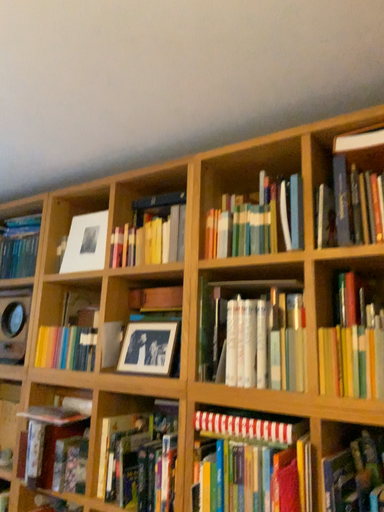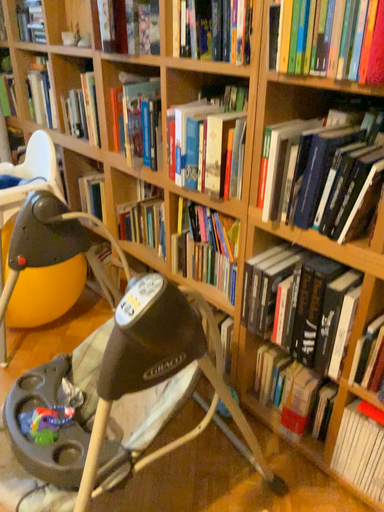
Question: How did the camera likely rotate when shooting the video?

Choices:
 (A) rotated downward
 (B) rotated upward

Answer: (A)